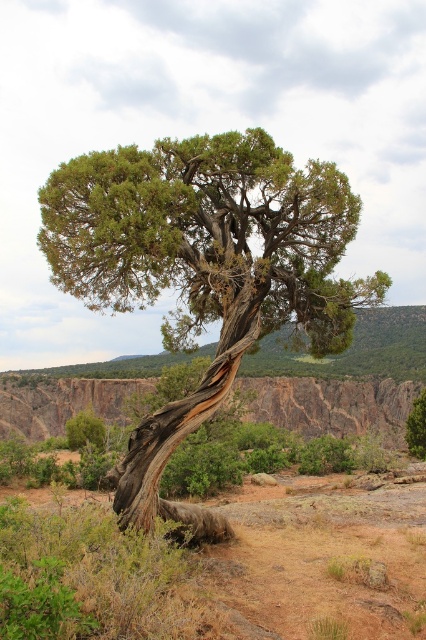
You are an environmental scientist assessing the stability of the terrain. You observe the green textured tree at center and the rusty rock cliff at center. Which object has a narrower width?

The green textured tree at center has a lesser width compared to the rusty rock cliff at center, so the green textured tree at center is narrower in width.

You are a hiker who has just arrived at the base of the green textured tree at center. If you were to walk directly towards the tree from your current position, which direction would you need to head?

Since the green textured tree at center is located at point coordinates of 0.422 on the x and 0.479 on the y axis, you would need to walk towards the center of the image to reach it.